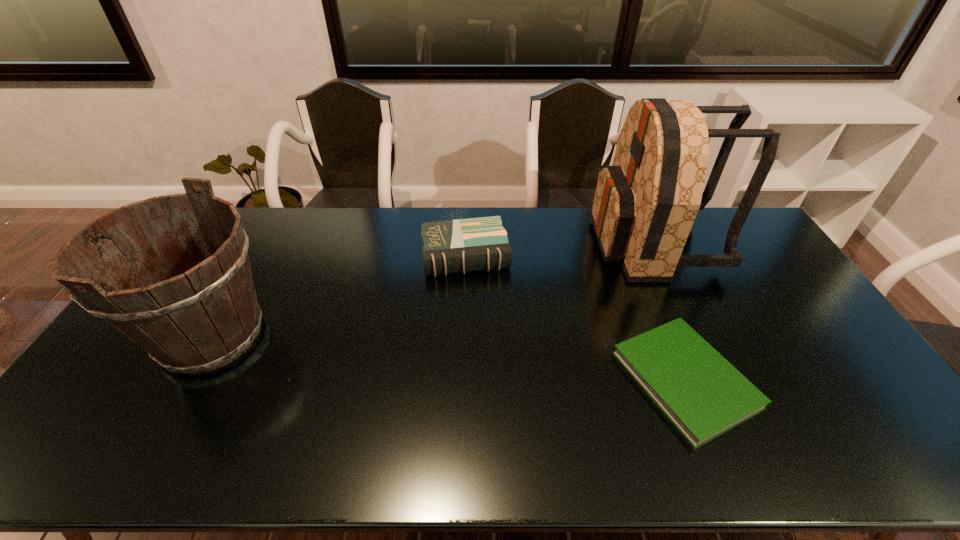
This screenshot has width=960, height=540. In order to click on the tallest object in this screenshot , I will do `click(645, 204)`.

The image size is (960, 540). In order to click on the second tallest object in this screenshot , I will do `click(205, 315)`.

The height and width of the screenshot is (540, 960). Identify the location of the leftmost object. (205, 315).

The image size is (960, 540). In order to click on the farther paperback book in this screenshot , I will do `click(463, 245)`.

Identify the location of the third object from right to left. (463, 245).

Where is `the right paperback book`? This screenshot has height=540, width=960. the right paperback book is located at coordinates (704, 395).

Locate an element on the screen. This screenshot has width=960, height=540. the shorter paperback book is located at coordinates (704, 395).

You are a GUI agent. You are given a task and a screenshot of the screen. Output one action in this format:
    pyautogui.click(x=<x>, y=<y>)
    Task: Click on the free space located on the front face of the backpack
    
    Given the screenshot: What is the action you would take?
    pyautogui.click(x=540, y=242)

Find the location of a particular element. vacant area situated on the front face of the backpack is located at coordinates (554, 242).

Identify the location of free space located on the front face of the backpack. The image size is (960, 540). (523, 242).